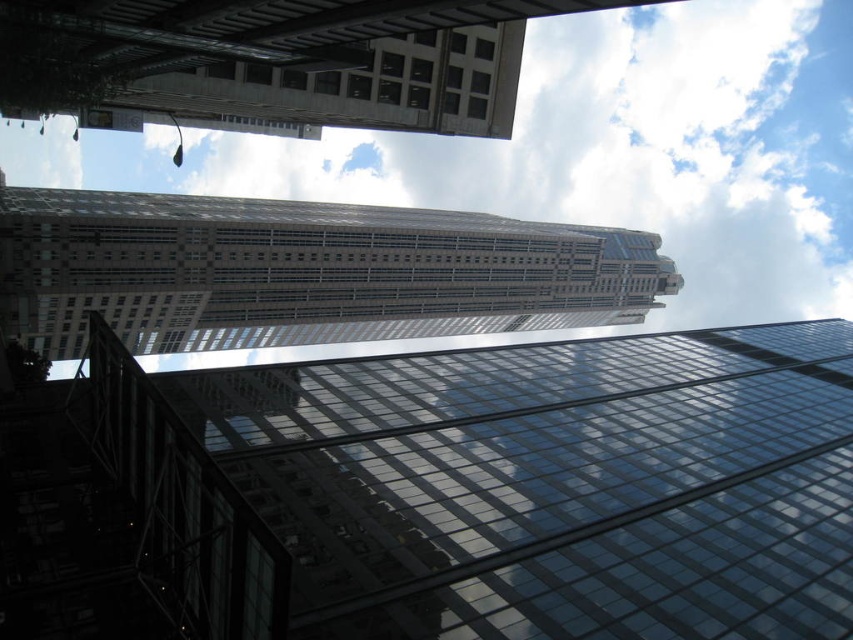
The image size is (853, 640). What do you see at coordinates (585, 150) in the screenshot?
I see `white fluffy cloud at upper center` at bounding box center [585, 150].

Does white fluffy cloud at upper center come behind glassy steel skyscraper at upper center?

Yes, white fluffy cloud at upper center is behind glassy steel skyscraper at upper center.

At what (x,y) coordinates should I click in order to perform the action: click on white fluffy cloud at upper center. Please return your answer as a coordinate pair (x, y). This screenshot has width=853, height=640. Looking at the image, I should click on (585, 150).

Find the location of a particular element. This screenshot has width=853, height=640. white fluffy cloud at upper center is located at coordinates [585, 150].

Can you confirm if transparent glass building at center is shorter than glassy steel skyscraper at upper center?

Yes.

How distant is transparent glass building at center from glassy steel skyscraper at upper center?

transparent glass building at center and glassy steel skyscraper at upper center are 207.59 feet apart from each other.

Between point (627, 580) and point (614, 291), which one is positioned in front?

Point (627, 580)

You are a GUI agent. You are given a task and a screenshot of the screen. Output one action in this format:
    pyautogui.click(x=<x>, y=<y>)
    Task: Click on the transparent glass building at center
    The height and width of the screenshot is (640, 853).
    Given the screenshot: What is the action you would take?
    pyautogui.click(x=445, y=493)

Image resolution: width=853 pixels, height=640 pixels. What do you see at coordinates (445, 493) in the screenshot? I see `transparent glass building at center` at bounding box center [445, 493].

Does transparent glass building at center come behind white fluffy cloud at upper center?

No, it is not.

Does point (321, 625) lie behind point (741, 131)?

That is False.

The width and height of the screenshot is (853, 640). Find the location of `transparent glass building at center`. transparent glass building at center is located at coordinates (445, 493).